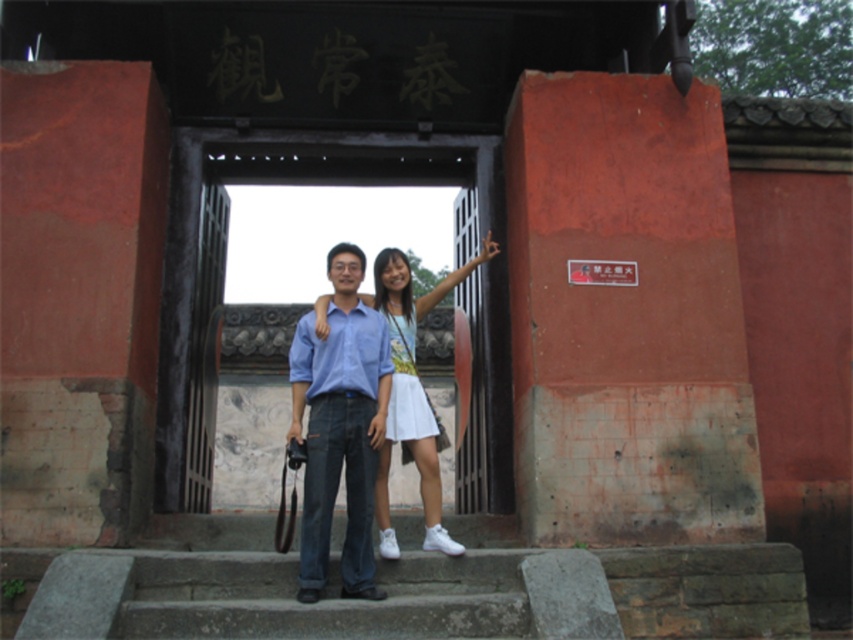
You are standing in front of the traditional Chinese gate and see two points marked in the scene. Which point is closer to you, point [479,195] or point [289,438]?

Point [479,195] is further to the viewer than point [289,438], so point [289,438] is closer to you.

You are a photographer standing on the stone steps and want to take a photo of the wooden gate at center and the white cotton dress at center. Which object is closer to you?

The wooden gate at center is closer to you than the white cotton dress at center.

You are standing at point (329, 394) and want to take a photo of the traditional Chinese gate. The camera you have can focus up to 30 meters. Will the camera be able to capture the gate clearly?

The distance of point (329, 394) from camera is 27.52 meters, which is within the camera focus range of 30 meters. Therefore, the camera can capture the gate clearly.